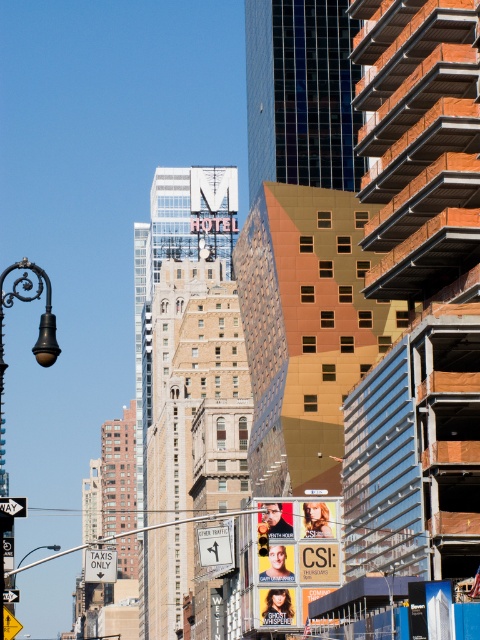
Does black metal lamp post at left have a greater width compared to white plastic street sign at upper center?

Correct, the width of black metal lamp post at left exceeds that of white plastic street sign at upper center.

Based on the photo, is black metal lamp post at left below white plastic street sign at upper center?

Indeed, black metal lamp post at left is positioned under white plastic street sign at upper center.

Does point (2, 362) lie behind point (12, 499)?

Yes, it is.

Where is `black metal lamp post at left`? The width and height of the screenshot is (480, 640). black metal lamp post at left is located at coordinates (39, 317).

Can you confirm if metallic gold billboard at center is smaller than black metal lamp post at left?

Correct, metallic gold billboard at center occupies less space than black metal lamp post at left.

Does metallic gold billboard at center have a larger size compared to black metal lamp post at left?

No, metallic gold billboard at center is not bigger than black metal lamp post at left.

Which is in front, point (291, 624) or point (25, 268)?

Point (25, 268)

Find the location of a particular element. Image resolution: width=480 pixels, height=640 pixels. metallic gold billboard at center is located at coordinates (295, 557).

Does metallic gold billboard at center appear under white plastic street sign at upper center?

Yes, metallic gold billboard at center is below white plastic street sign at upper center.

Can you confirm if metallic gold billboard at center is taller than white plastic street sign at upper center?

No, metallic gold billboard at center is not taller than white plastic street sign at upper center.

Is point (300, 538) positioned in front of point (21, 513)?

No, it is behind (21, 513).

This screenshot has height=640, width=480. Identify the location of metallic gold billboard at center. (295, 557).